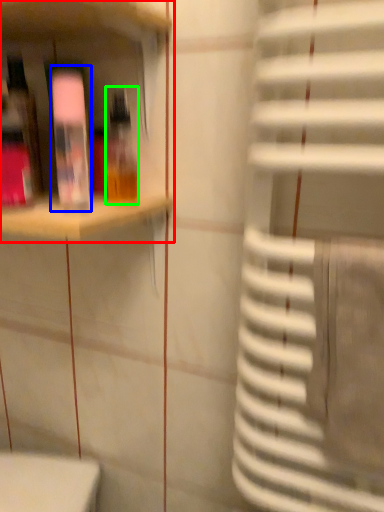
Question: Estimate the real-world distances between objects in this image. Which object is closer to shelf (highlighted by a red box), bottle (highlighted by a blue box) or bottle (highlighted by a green box)?

Choices:
 (A) bottle
 (B) bottle

Answer: (A)